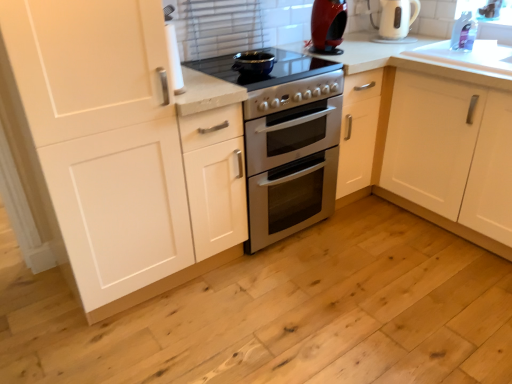
This screenshot has width=512, height=384. Identify the location of vacant space in front of white glossy oven at center, acting as the first appliance starting from the bottom. (291, 284).